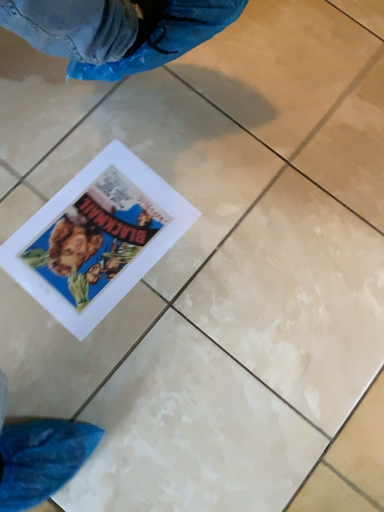
The width and height of the screenshot is (384, 512). What are the coordinates of `vacant area in front of blue matte poster at center` in the screenshot? It's located at (82, 356).